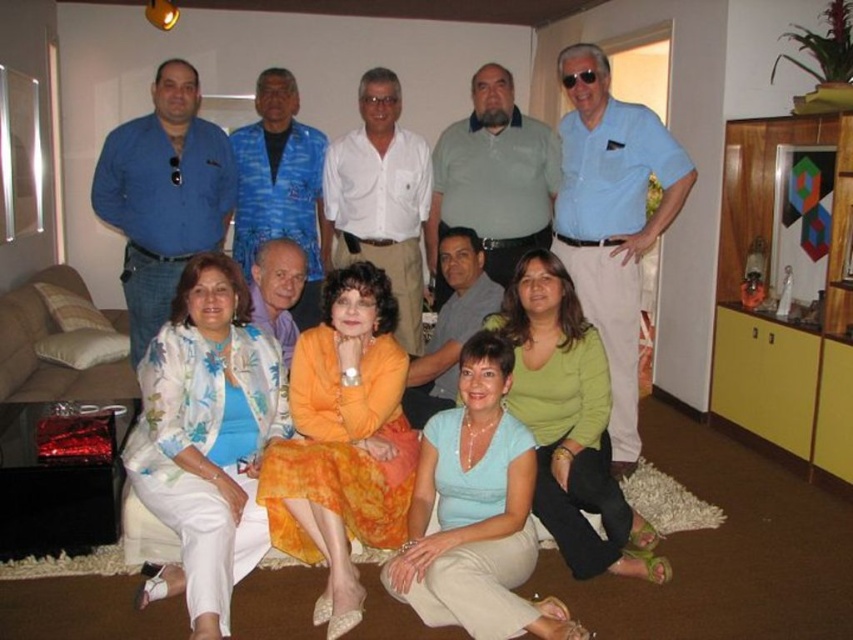
In the scene shown: Does orange satin dress at center appear on the right side of light blue fabric blouse at lower center?

In fact, orange satin dress at center is to the left of light blue fabric blouse at lower center.

Based on the photo, does orange satin dress at center have a greater height compared to light blue fabric blouse at lower center?

No.

Where is `orange satin dress at center`? The width and height of the screenshot is (853, 640). orange satin dress at center is located at coordinates (343, 442).

Describe the element at coordinates (236, 304) in the screenshot. I see `floral fabric jacket at center` at that location.

You are a GUI agent. You are given a task and a screenshot of the screen. Output one action in this format:
    pyautogui.click(x=<x>, y=<y>)
    Task: Click on the floral fabric jacket at center
    
    Given the screenshot: What is the action you would take?
    pyautogui.click(x=236, y=304)

Who is more forward, (132, 352) or (485, 508)?

Point (485, 508) is in front.

Find the location of a particular element. The image size is (853, 640). floral fabric jacket at center is located at coordinates (236, 304).

Does floral fabric jacket at center appear under light blue fabric blouse at lower center?

Incorrect, floral fabric jacket at center is not positioned below light blue fabric blouse at lower center.

Is point (320, 218) less distant than point (561, 486)?

No, it is not.

I want to click on floral fabric jacket at center, so click(x=236, y=304).